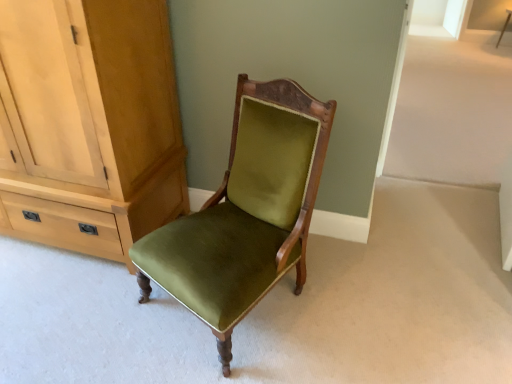
Question: Can you confirm if matte wood cabinet at left is shorter than wooden side table at upper right?

Choices:
 (A) yes
 (B) no

Answer: (B)

Question: Is matte wood cabinet at left facing towards wooden side table at upper right?

Choices:
 (A) no
 (B) yes

Answer: (A)

Question: Is matte wood cabinet at left positioned beyond the bounds of wooden side table at upper right?

Choices:
 (A) yes
 (B) no

Answer: (A)

Question: Is matte wood cabinet at left taller than wooden side table at upper right?

Choices:
 (A) no
 (B) yes

Answer: (B)

Question: Considering the relative sizes of matte wood cabinet at left and wooden side table at upper right in the image provided, is matte wood cabinet at left wider than wooden side table at upper right?

Choices:
 (A) yes
 (B) no

Answer: (A)

Question: From a real-world perspective, is wooden side table at upper right positioned above or below matte wood cabinet at left?

Choices:
 (A) above
 (B) below

Answer: (B)

Question: In terms of height, does wooden side table at upper right look taller or shorter compared to matte wood cabinet at left?

Choices:
 (A) short
 (B) tall

Answer: (A)

Question: Is wooden side table at upper right wider or thinner than matte wood cabinet at left?

Choices:
 (A) wide
 (B) thin

Answer: (B)

Question: Considering the relative positions of wooden side table at upper right and matte wood cabinet at left in the image provided, is wooden side table at upper right to the left or to the right of matte wood cabinet at left?

Choices:
 (A) right
 (B) left

Answer: (A)

Question: Is point (141, 77) positioned closer to the camera than point (220, 258)?

Choices:
 (A) closer
 (B) farther

Answer: (B)

Question: Would you say matte wood cabinet at left is inside or outside velvet green chair at center?

Choices:
 (A) inside
 (B) outside

Answer: (B)

Question: Considering the positions of matte wood cabinet at left and velvet green chair at center in the image, is matte wood cabinet at left bigger or smaller than velvet green chair at center?

Choices:
 (A) big
 (B) small

Answer: (A)

Question: From the image's perspective, is matte wood cabinet at left positioned above or below velvet green chair at center?

Choices:
 (A) above
 (B) below

Answer: (A)

Question: From the image's perspective, is velvet green chair at center positioned above or below matte wood cabinet at left?

Choices:
 (A) above
 (B) below

Answer: (B)

Question: In terms of size, does velvet green chair at center appear bigger or smaller than matte wood cabinet at left?

Choices:
 (A) big
 (B) small

Answer: (B)